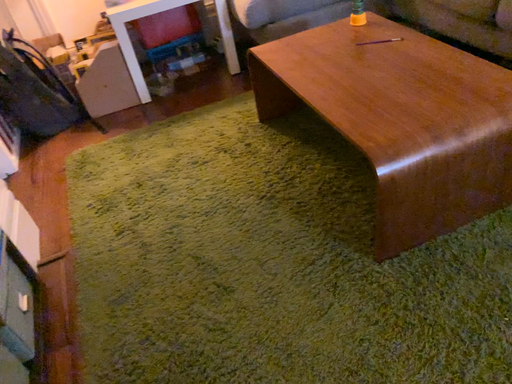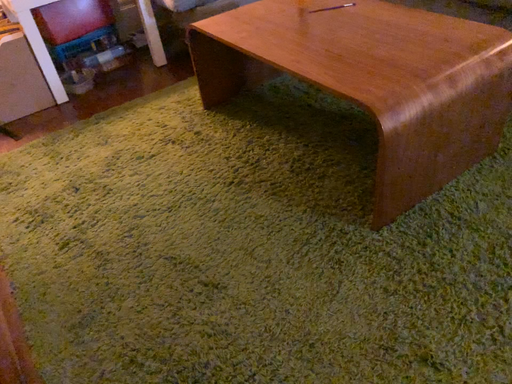
Question: Which way did the camera rotate in the video?

Choices:
 (A) rotated left
 (B) rotated right

Answer: (B)